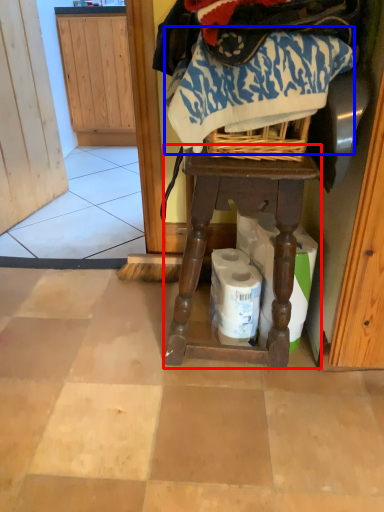
Question: Which object is further to the camera taking this photo, furniture (highlighted by a red box) or clothing (highlighted by a blue box)?

Choices:
 (A) furniture
 (B) clothing

Answer: (A)